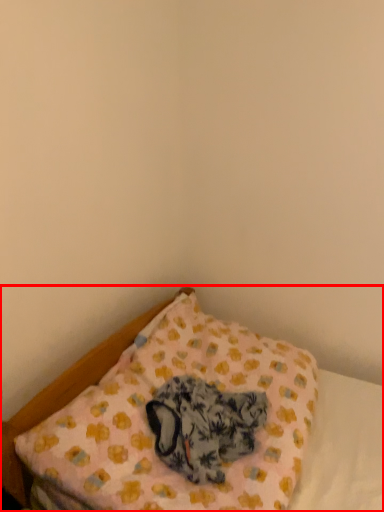
Question: Where is bed (annotated by the red box) located in relation to animal in the image?

Choices:
 (A) left
 (B) right

Answer: (B)